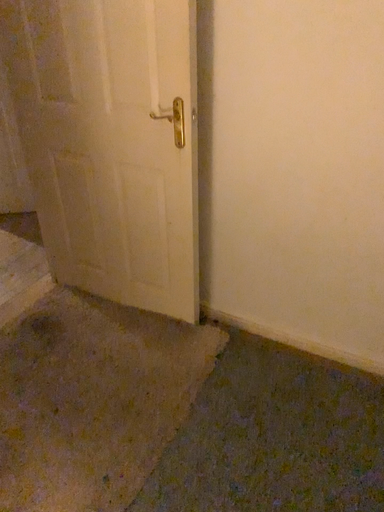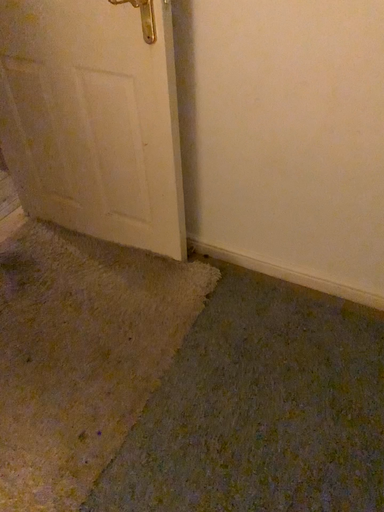
Question: Which way did the camera rotate in the video?

Choices:
 (A) rotated downward
 (B) rotated upward

Answer: (A)